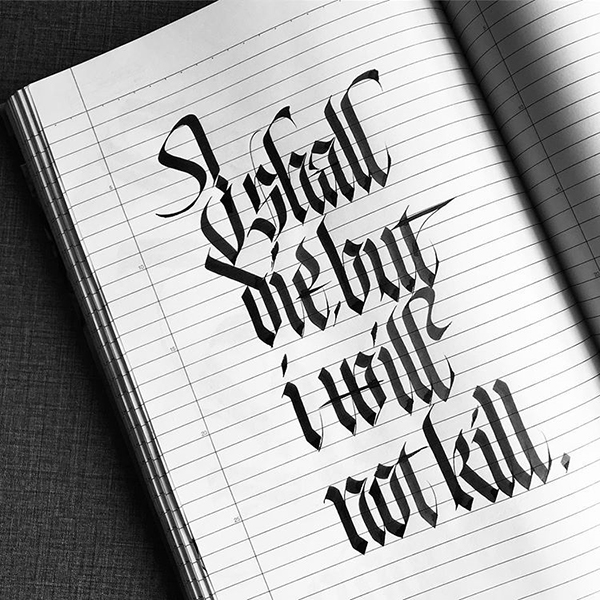
At what (x,y) coordinates should I click in order to perform the action: click on book. Please return your answer as a coordinate pair (x, y). This screenshot has height=600, width=600. Looking at the image, I should click on (168, 314).